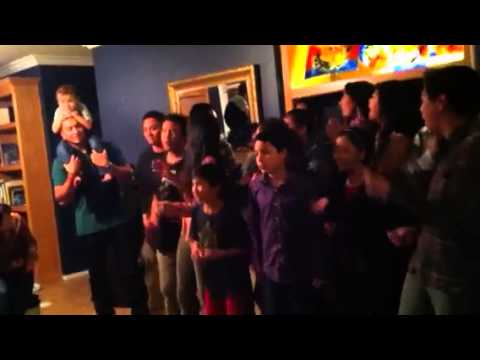
The width and height of the screenshot is (480, 360). Find the location of `ceiling`. ceiling is located at coordinates (56, 47).